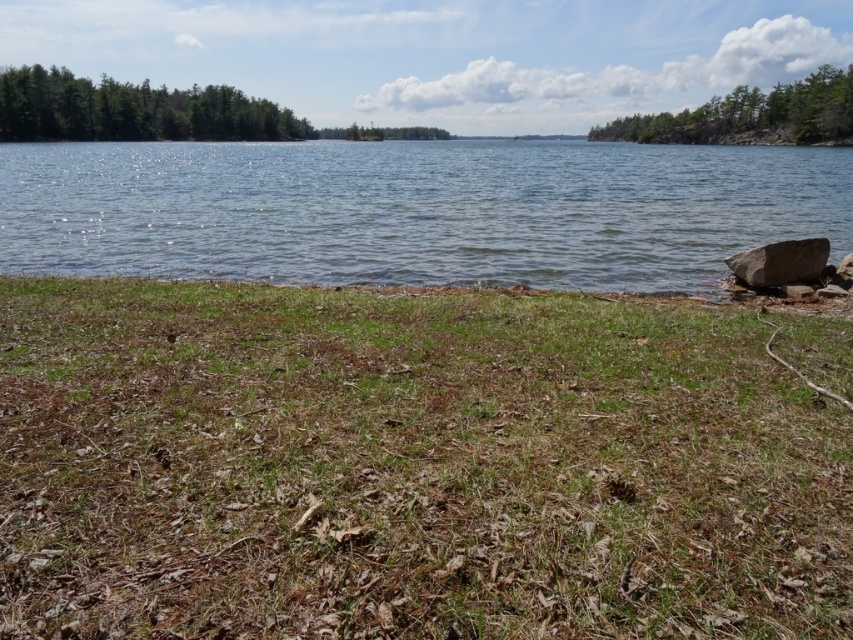
You are standing at the center of the grassy area in the lakeside scene. Looking towards the background, where are the green leafy trees at upper right located in terms of direction and position?

The green leafy trees at upper right are located at the upper right direction and position at point coordinates of [749,115].

In the scene shown: You are standing at point [836,80] and want to walk to the other side of the lake. The path is straight. If your average walking speed is 3 feet per second, how many seconds will it take you to reach the opposite shore?

The distance between the two points is 392.58 feet. At a walking speed of 3 feet per second, it would take approximately 130.86 seconds to reach the opposite shore.